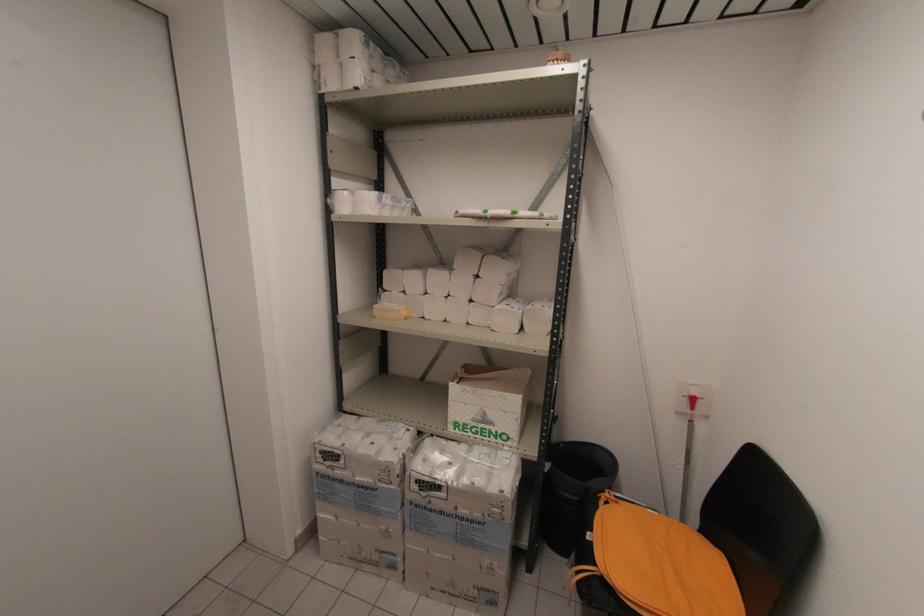
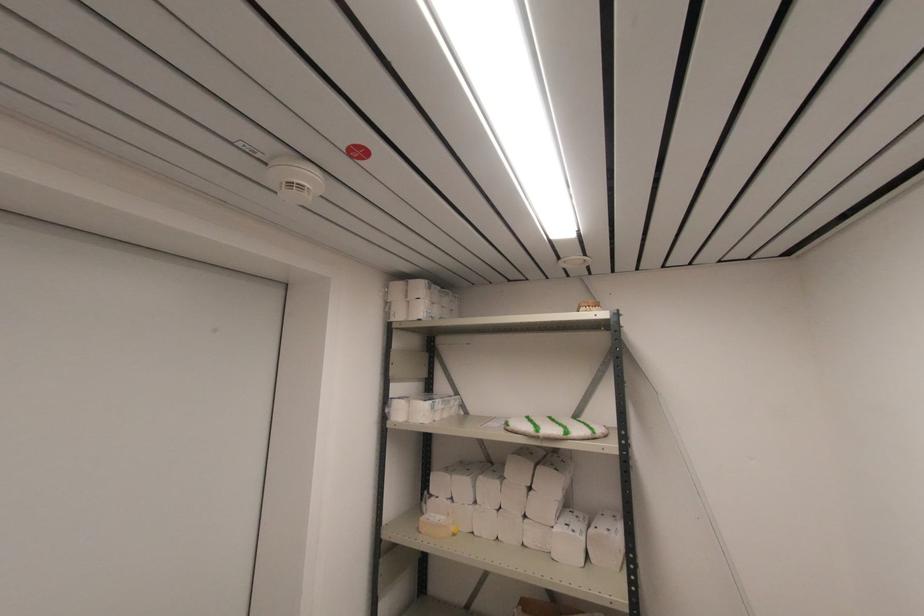
Where in the second image is the point corresponding to pixel 375 317 from the first image?

(420, 533)